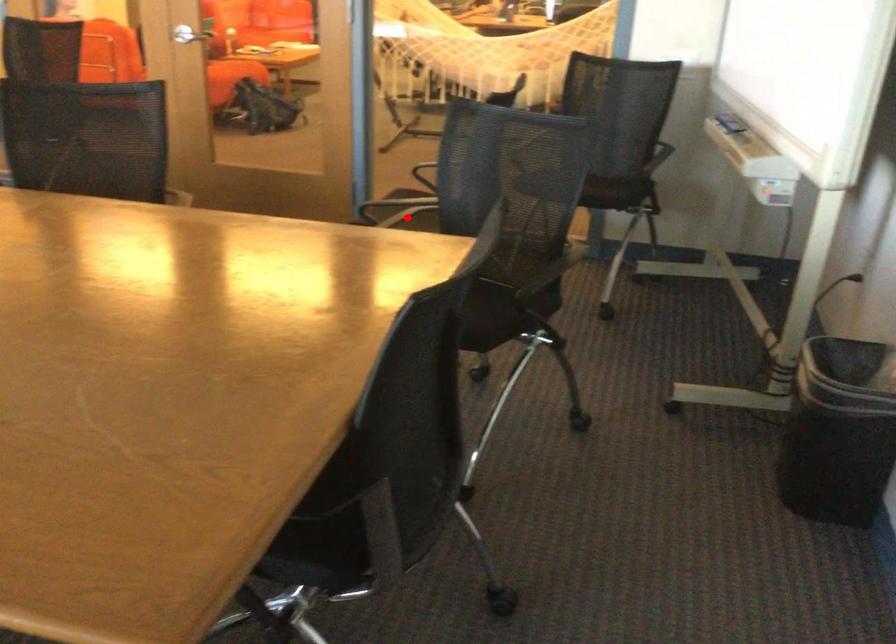
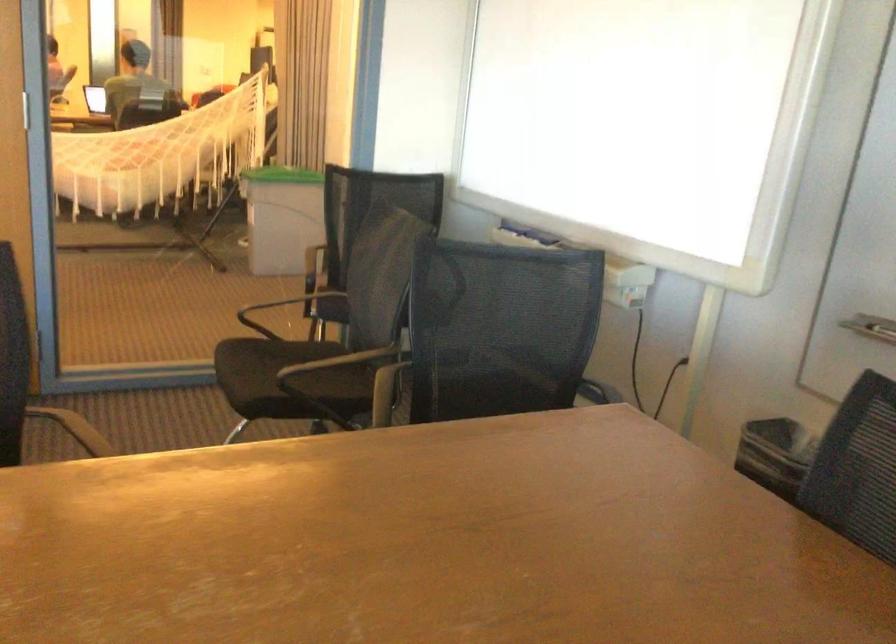
Question: I am providing you with two images of the same scene from different viewpoints. A red point is shown in image1. For the corresponding object point in image2, is it positioned nearer or farther from the camera?

Choices:
 (A) Nearer
 (B) Farther

Answer: (A)